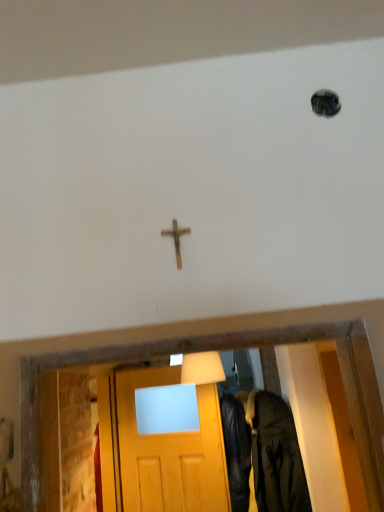
Identify the location of wooden cross at center. (176, 239).

Describe the element at coordinates (176, 239) in the screenshot. I see `wooden cross at center` at that location.

In order to face wooden cross at center, should I rotate leftwards or rightwards?

You should rotate left by 2.631 degrees.

Find the location of a particular element. This screenshot has height=512, width=384. leather jacket at lower right is located at coordinates coord(274,456).

The height and width of the screenshot is (512, 384). What do you see at coordinates (274, 456) in the screenshot? I see `leather jacket at lower right` at bounding box center [274, 456].

Locate an element on the screen. wooden cross at center is located at coordinates (176, 239).

Is wooden cross at center to the left of leather jacket at lower right from the viewer's perspective?

Indeed, wooden cross at center is positioned on the left side of leather jacket at lower right.

Consider the image. Is wooden cross at center behind leather jacket at lower right?

No, it is in front of leather jacket at lower right.

Considering the positions of points (172, 234) and (280, 435), is point (172, 234) farther from camera compared to point (280, 435)?

That is False.

From the image's perspective, which one is positioned lower, wooden cross at center or leather jacket at lower right?

leather jacket at lower right appears lower in the image.

From a real-world perspective, is wooden cross at center above or below leather jacket at lower right?

wooden cross at center is above leather jacket at lower right.

In terms of width, does wooden cross at center look wider or thinner when compared to leather jacket at lower right?

wooden cross at center is thinner than leather jacket at lower right.

Can you confirm if wooden cross at center is shorter than leather jacket at lower right?

Correct, wooden cross at center is not as tall as leather jacket at lower right.

Can you confirm if wooden cross at center is bigger than leather jacket at lower right?

Incorrect, wooden cross at center is not larger than leather jacket at lower right.

Does wooden cross at center contain leather jacket at lower right?

No.

Is wooden cross at center in contact with leather jacket at lower right?

wooden cross at center is not next to leather jacket at lower right, and they're not touching.

Could you tell me if wooden cross at center is facing leather jacket at lower right?

No, wooden cross at center is not turned towards leather jacket at lower right.

What's the angular difference between wooden cross at center and leather jacket at lower right's facing directions?

There is a 0.102-degree angle between the facing directions of wooden cross at center and leather jacket at lower right.

Locate an element on the screen. The height and width of the screenshot is (512, 384). clothing beneath the wooden cross at center (from a real-world perspective) is located at coordinates (274, 456).

Is leather jacket at lower right at the left side of wooden cross at center?

In fact, leather jacket at lower right is to the right of wooden cross at center.

Relative to wooden cross at center, is leather jacket at lower right in front or behind?

Clearly, leather jacket at lower right is behind wooden cross at center.

Does point (276, 488) lie in front of point (177, 223)?

No, (276, 488) is further to viewer.

From the image's perspective, is leather jacket at lower right over wooden cross at center?

No.

From a real-world perspective, is leather jacket at lower right on wooden cross at center?

Actually, leather jacket at lower right is physically below wooden cross at center in the real world.

Which of these two, leather jacket at lower right or wooden cross at center, is thinner?

wooden cross at center is thinner.

Can you confirm if leather jacket at lower right is shorter than wooden cross at center?

No, leather jacket at lower right is not shorter than wooden cross at center.

Considering the relative sizes of leather jacket at lower right and wooden cross at center in the image provided, is leather jacket at lower right smaller than wooden cross at center?

No, leather jacket at lower right is not smaller than wooden cross at center.

Is leather jacket at lower right not inside wooden cross at center?

leather jacket at lower right is positioned outside wooden cross at center.

Is leather jacket at lower right not close to wooden cross at center?

Absolutely, leather jacket at lower right is distant from wooden cross at center.

Is wooden cross at center at the back of leather jacket at lower right?

No, leather jacket at lower right's orientation is not away from wooden cross at center.

Measure the distance from leather jacket at lower right to wooden cross at center.

They are 6.49 feet apart.

This screenshot has height=512, width=384. I want to click on crucifix in front of the leather jacket at lower right, so click(x=176, y=239).

Locate an element on the screen. clothing that is on the right side of wooden cross at center is located at coordinates 274,456.

Where is `clothing below the wooden cross at center (from a real-world perspective)`? Image resolution: width=384 pixels, height=512 pixels. clothing below the wooden cross at center (from a real-world perspective) is located at coordinates (274, 456).